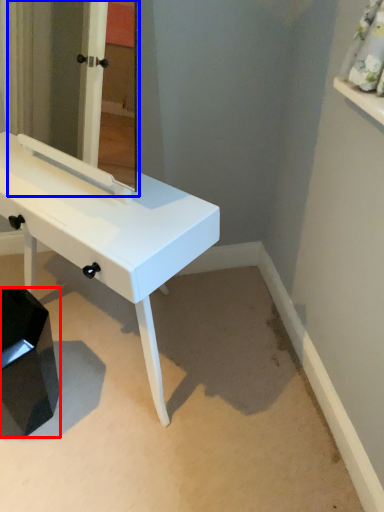
Question: Which point is closer to the camera, step stool (highlighted by a red box) or mirror (highlighted by a blue box)?

Choices:
 (A) step stool
 (B) mirror

Answer: (B)